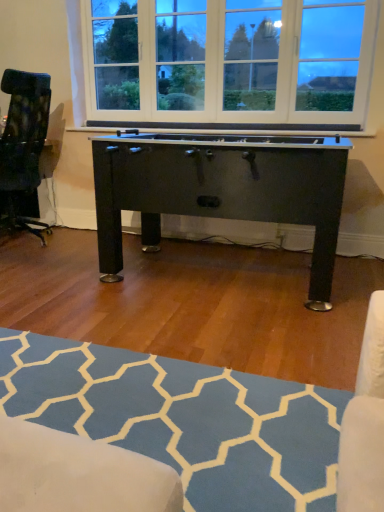
The height and width of the screenshot is (512, 384). What do you see at coordinates (184, 419) in the screenshot?
I see `blue textured rug at lower center` at bounding box center [184, 419].

Identify the location of blue textured rug at lower center. (184, 419).

In order to click on blue textured rug at lower center in this screenshot , I will do `click(184, 419)`.